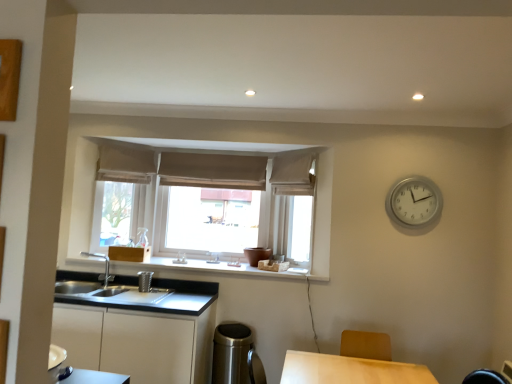
This screenshot has height=384, width=512. What are the coordinates of `blank space situated above white fabric curtain at upper center, which appears as the 3th curtain when viewed from the left (from a real-world perspective)` in the screenshot? It's located at click(293, 153).